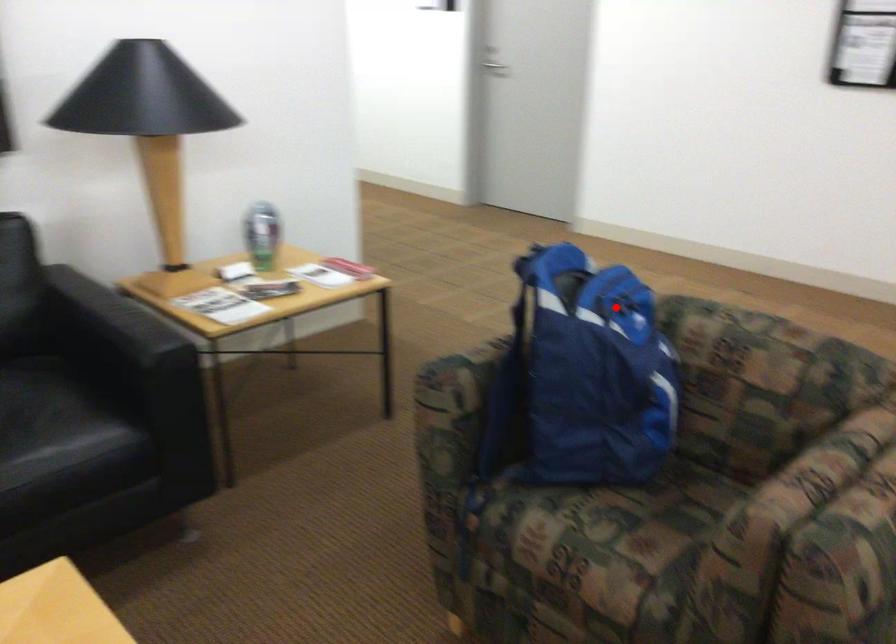
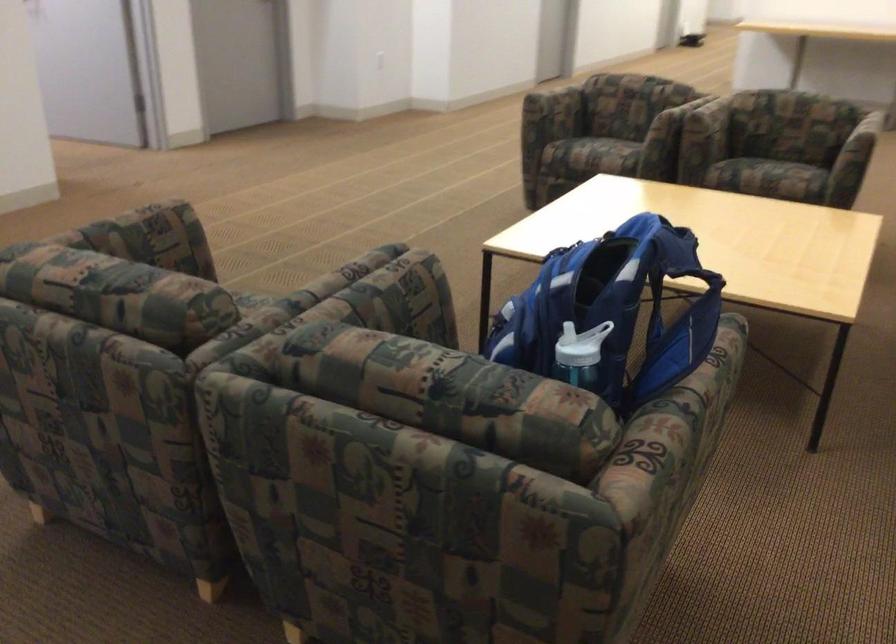
Question: A red point is marked in image1. In image2, is the corresponding 3D point closer to the camera or farther? Reply with the corresponding letter.

Choices:
 (A) The corresponding 3D point is closer.
 (B) The corresponding 3D point is farther.

Answer: (A)